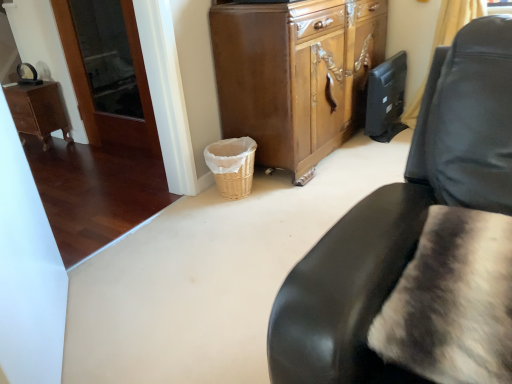
The image size is (512, 384). Find the location of `free space between wooden cabinet at center and woven wicker basket at lower center`. free space between wooden cabinet at center and woven wicker basket at lower center is located at coordinates (268, 190).